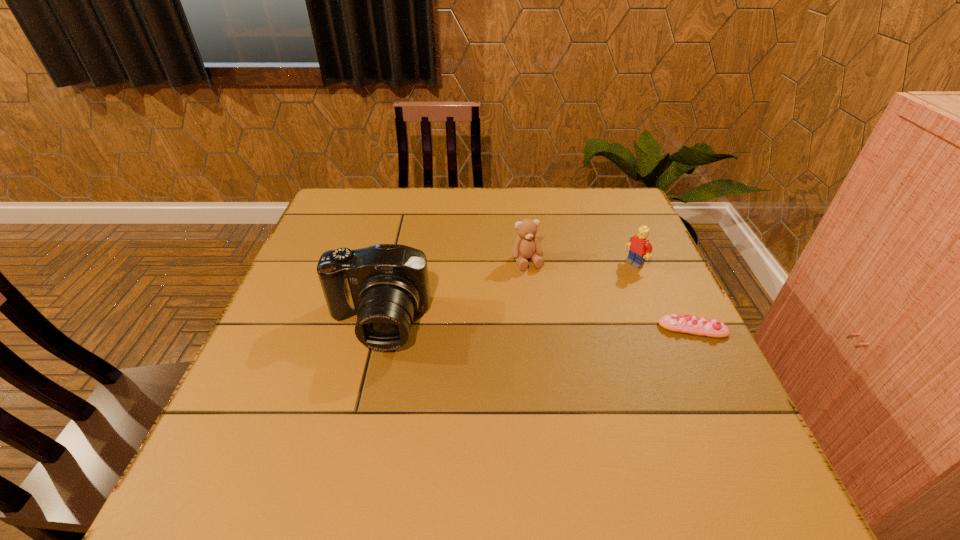
Locate an element on the screen. The width and height of the screenshot is (960, 540). vacant space at the far left corner of the desktop is located at coordinates (328, 203).

I want to click on blank space at the near left corner of the desktop, so click(310, 404).

The width and height of the screenshot is (960, 540). In the image, there is a desktop. In order to click on vacant space at the far right corner in this screenshot , I will do `click(616, 218)`.

What are the coordinates of `vacant space at the near right corner of the desktop` in the screenshot? It's located at (653, 404).

The image size is (960, 540). I want to click on vacant point located between the eclair and the Lego, so click(664, 296).

What are the coordinates of `vacant space that is in between the teddy bear and the leftmost object` in the screenshot? It's located at (452, 292).

The image size is (960, 540). I want to click on empty space between the shortest object and the Lego, so click(664, 296).

The width and height of the screenshot is (960, 540). I want to click on vacant area between the Lego and the teddy bear, so click(x=581, y=262).

The width and height of the screenshot is (960, 540). In order to click on vacant point located between the leftmost object and the shortest object in this screenshot , I will do `click(535, 326)`.

At what (x,y) coordinates should I click in order to perform the action: click on free space between the third object from right to left and the Lego. Please return your answer as a coordinate pair (x, y). This screenshot has width=960, height=540. Looking at the image, I should click on (581, 262).